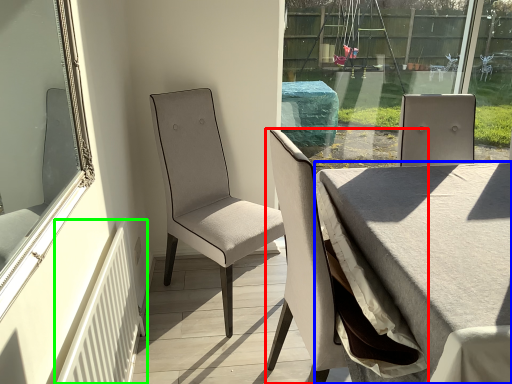
Question: Considering the real-world distances, which object is closest to chair (highlighted by a red box)? table (highlighted by a blue box) or radiator (highlighted by a green box).

Choices:
 (A) table
 (B) radiator

Answer: (A)